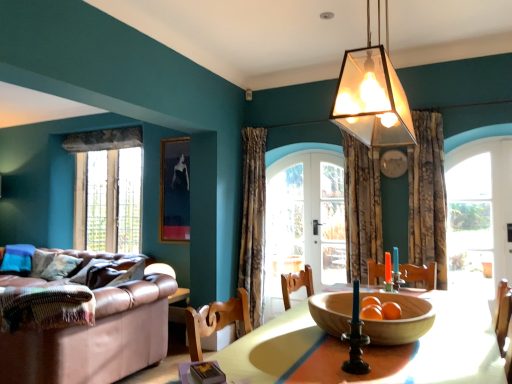
Measure the distance between clear glass window at left, the 2th window viewed from the front, and camera.

clear glass window at left, the 2th window viewed from the front, is 5.07 meters away from camera.

Describe the element at coordinates (372, 98) in the screenshot. I see `translucent glass pendant light at upper center` at that location.

Measure the distance between point (461, 333) and camera.

Point (461, 333) and camera are 1.72 meters apart.

Where is `wooden table at center`? The height and width of the screenshot is (384, 512). wooden table at center is located at coordinates (453, 345).

Where is `leather couch at left`? The height and width of the screenshot is (384, 512). leather couch at left is located at coordinates (96, 339).

This screenshot has height=384, width=512. I want to click on clear glass window at left, the 1th window from the back, so click(108, 189).

Does wooden bowl at center turn towards leather couch at left?

No, wooden bowl at center does not turn towards leather couch at left.

From a real-world perspective, is wooden bowl at center under leather couch at left?

No, from a real-world perspective, wooden bowl at center is not under leather couch at left.

Which object is further away from the camera taking this photo, wooden bowl at center or leather couch at left?

leather couch at left is further from the camera.

Is floral fabric curtain at center, the second curtain in the left-to-right sequence, located within clear glass window at left, the 2th window viewed from the front?

Actually, floral fabric curtain at center, the second curtain in the left-to-right sequence, is outside clear glass window at left, the 2th window viewed from the front.

Between clear glass window at left, the 2th window viewed from the front, and floral fabric curtain at center, the second curtain in the left-to-right sequence, which one has less height?

clear glass window at left, the 2th window viewed from the front.

From the image's perspective, which curtain is the 1st one above the clear glass window at left, positioned as the 1th window in left-to-right order? Please provide its 2D coordinates.

[(361, 207)]

From the image's perspective, is textured floral fabric curtain at center, the first curtain positioned from the right, positioned above or below leather couch at left?

Based on their image positions, textured floral fabric curtain at center, the first curtain positioned from the right, is located above leather couch at left.

Between textured floral fabric curtain at center, which appears as the third curtain when viewed from the left, and leather couch at left, which one has larger size?

leather couch at left is bigger.

Is textured floral fabric curtain at center, which appears as the third curtain when viewed from the left, touching leather couch at left?

No, textured floral fabric curtain at center, which appears as the third curtain when viewed from the left, is not next to leather couch at left.

From the picture: Considering the relative positions of textured floral fabric curtain at center, which appears as the third curtain when viewed from the left, and leather couch at left in the image provided, is textured floral fabric curtain at center, which appears as the third curtain when viewed from the left, in front of leather couch at left?

No, textured floral fabric curtain at center, which appears as the third curtain when viewed from the left, is further to the viewer.

Relative to floral fabric curtain at center, placed as the first curtain when sorted from left to right, is translucent glass pendant light at upper center in front or behind?

In the image, translucent glass pendant light at upper center appears in front of floral fabric curtain at center, placed as the first curtain when sorted from left to right.

Between point (388, 131) and point (256, 167), which one is positioned behind?

The point (256, 167) is farther.

Does translucent glass pendant light at upper center touch floral fabric curtain at center, which is the third curtain in right-to-left order?

No, translucent glass pendant light at upper center is not next to floral fabric curtain at center, which is the third curtain in right-to-left order.

Considering the sizes of objects clear glass window at right, marked as the 1th window in a front-to-back arrangement, and floral fabric curtain at center, placed as the first curtain when sorted from left to right, in the image provided, who is smaller, clear glass window at right, marked as the 1th window in a front-to-back arrangement, or floral fabric curtain at center, placed as the first curtain when sorted from left to right,?

clear glass window at right, marked as the 1th window in a front-to-back arrangement.

Locate an element on the screen. The height and width of the screenshot is (384, 512). window lying in front of the floral fabric curtain at center, which is the third curtain in right-to-left order is located at coordinates (470, 223).

From the image's perspective, would you say clear glass window at right, acting as the second window starting from the back, is positioned over floral fabric curtain at center, placed as the first curtain when sorted from left to right?

Correct, clear glass window at right, acting as the second window starting from the back, appears higher than floral fabric curtain at center, placed as the first curtain when sorted from left to right, in the image.

Measure the distance between clear glass window at right, arranged as the first window when viewed from the right, and floral fabric curtain at center, placed as the first curtain when sorted from left to right.

clear glass window at right, arranged as the first window when viewed from the right, is 6.18 feet away from floral fabric curtain at center, placed as the first curtain when sorted from left to right.

Consider the image. Is textured floral fabric curtain at center, which appears as the third curtain when viewed from the left, positioned beyond the bounds of translucent glass pendant light at upper center?

Indeed, textured floral fabric curtain at center, which appears as the third curtain when viewed from the left, is completely outside translucent glass pendant light at upper center.

Considering the sizes of objects textured floral fabric curtain at center, the first curtain positioned from the right, and translucent glass pendant light at upper center in the image provided, who is thinner, textured floral fabric curtain at center, the first curtain positioned from the right, or translucent glass pendant light at upper center?

translucent glass pendant light at upper center is thinner.

Are textured floral fabric curtain at center, which appears as the third curtain when viewed from the left, and translucent glass pendant light at upper center far apart?

Absolutely, textured floral fabric curtain at center, which appears as the third curtain when viewed from the left, is distant from translucent glass pendant light at upper center.

I want to click on lamp in front of the textured floral fabric curtain at center, the first curtain positioned from the right, so click(372, 98).

Considering the positions of point (490, 256) and point (395, 104), is point (490, 256) closer or farther from the camera than point (395, 104)?

Point (490, 256) is farther from the camera than point (395, 104).

From the picture: From the image's perspective, is clear glass window at right, marked as the 1th window in a front-to-back arrangement, above translucent glass pendant light at upper center?

No, from the image's perspective, clear glass window at right, marked as the 1th window in a front-to-back arrangement, is not on top of translucent glass pendant light at upper center.

Is clear glass window at right, arranged as the first window when viewed from the right, looking in the opposite direction of translucent glass pendant light at upper center?

No, clear glass window at right, arranged as the first window when viewed from the right, is not facing the opposite direction of translucent glass pendant light at upper center.

You are a GUI agent. You are given a task and a screenshot of the screen. Output one action in this format:
    pyautogui.click(x=<x>, y=<y>)
    Task: Click on the lamp that is in front of the clear glass window at right, marked as the 1th window in a front-to-back arrangement
    This screenshot has height=384, width=512.
    Given the screenshot: What is the action you would take?
    pyautogui.click(x=372, y=98)

Locate an element on the screen. The height and width of the screenshot is (384, 512). bowl lying above the leather couch at left (from the image's perspective) is located at coordinates (400, 320).

Which curtain is the 2nd one when counting from the right side of the clear glass window at left, the 1th window from the back? Please provide its 2D coordinates.

[(361, 207)]

Estimate the real-world distances between objects in this image. Which object is closer to translucent glass pendant light at upper center, clear glass window at right, arranged as the first window when viewed from the right, or clear glass window at left, the 2th window viewed from the front?

clear glass window at right, arranged as the first window when viewed from the right, is positioned closer to the anchor translucent glass pendant light at upper center.

Estimate the real-world distances between objects in this image. Which object is closer to clear glass window at left, positioned as the 1th window in left-to-right order, floral fabric curtain at center, placed as the first curtain when sorted from left to right, or translucent glass pendant light at upper center?

floral fabric curtain at center, placed as the first curtain when sorted from left to right, lies closer to clear glass window at left, positioned as the 1th window in left-to-right order, than the other object.

Consider the image. Considering their positions, is wooden table at center positioned closer to clear glass window at left, the 1th window from the back, than textured floral fabric curtain at center, which appears as the third curtain when viewed from the left?

textured floral fabric curtain at center, which appears as the third curtain when viewed from the left, is positioned closer to the anchor clear glass window at left, the 1th window from the back.

In the scene shown: When comparing their distances from floral fabric curtain at center, which is the third curtain in right-to-left order, does leather couch at left or translucent glass pendant light at upper center seem closer?

Based on the image, leather couch at left appears to be nearer to floral fabric curtain at center, which is the third curtain in right-to-left order.

Which object lies further to the anchor point floral fabric curtain at center, which is the third curtain in right-to-left order, wooden table at center or clear glass door at center?

Based on the image, wooden table at center appears to be further to floral fabric curtain at center, which is the third curtain in right-to-left order.

Considering their positions, is floral fabric curtain at center, positioned as the 2th curtain in right-to-left order, positioned closer to wooden table at center than clear glass door at center?

Based on the image, floral fabric curtain at center, positioned as the 2th curtain in right-to-left order, appears to be nearer to wooden table at center.

Which object lies further to the anchor point clear glass door at center, translucent glass pendant light at upper center or clear glass window at left, the 2th window viewed from the front?

The object further to clear glass door at center is translucent glass pendant light at upper center.

Considering their positions, is wooden bowl at center positioned closer to floral fabric curtain at center, positioned as the 2th curtain in right-to-left order, than floral fabric curtain at center, which is the third curtain in right-to-left order?

floral fabric curtain at center, which is the third curtain in right-to-left order, is positioned closer to the anchor floral fabric curtain at center, positioned as the 2th curtain in right-to-left order.

Locate an element on the screen. Image resolution: width=512 pixels, height=384 pixels. studio couch between clear glass window at left, marked as the second window in a right-to-left arrangement, and textured floral fabric curtain at center, which appears as the third curtain when viewed from the left, from left to right is located at coordinates (96, 339).

Locate an element on the screen. studio couch between wooden table at center and clear glass door at center in the front-back direction is located at coordinates (96, 339).

Find the location of `studio couch between translucent glass pendant light at upper center and clear glass window at left, positioned as the 1th window in left-to-right order, along the z-axis`. studio couch between translucent glass pendant light at upper center and clear glass window at left, positioned as the 1th window in left-to-right order, along the z-axis is located at coordinates (96, 339).

Where is `lamp between wooden table at center and clear glass window at left, the 1th window from the back, along the z-axis`? The width and height of the screenshot is (512, 384). lamp between wooden table at center and clear glass window at left, the 1th window from the back, along the z-axis is located at coordinates (372, 98).